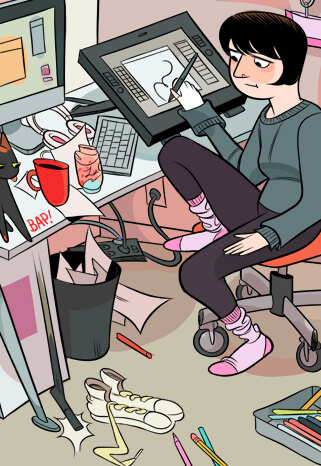
Locate an element on the screen. computer monitor is located at coordinates (25, 82).